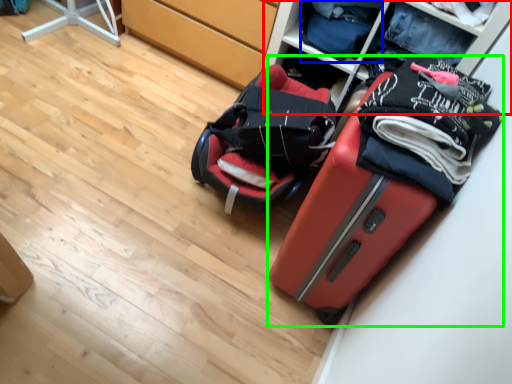
Question: Estimate the real-world distances between objects in this image. Which object is closer to shelf (highlighted by a red box), clothing (highlighted by a blue box) or suitcase (highlighted by a green box)?

Choices:
 (A) clothing
 (B) suitcase

Answer: (A)